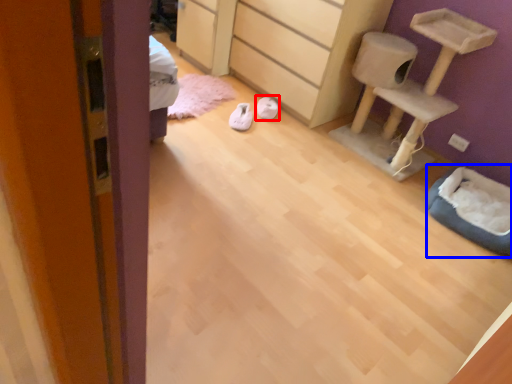
Question: Among these objects, which one is farthest to the camera, footwear (highlighted by a red box) or cat bed (highlighted by a blue box)?

Choices:
 (A) footwear
 (B) cat bed

Answer: (A)